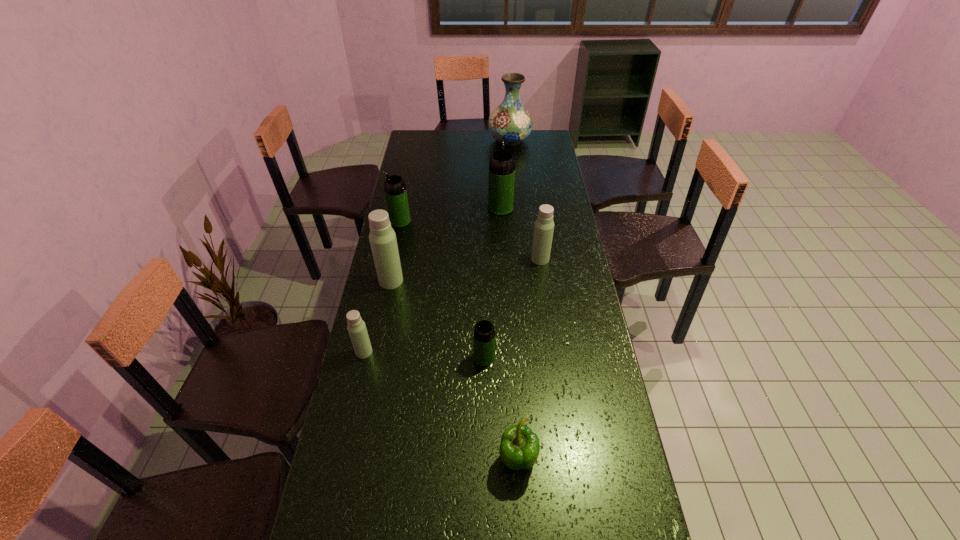
The image size is (960, 540). Find the location of `vacant space situated from the spout of the smallest green thermos bottle`. vacant space situated from the spout of the smallest green thermos bottle is located at coordinates (442, 357).

Where is `vacant space located on the front of the nearest light thermos bottle`? vacant space located on the front of the nearest light thermos bottle is located at coordinates (353, 399).

At what (x,y) coordinates should I click in order to perform the action: click on free location located on the left of the bell pepper. Please return your answer as a coordinate pair (x, y). This screenshot has height=540, width=960. Looking at the image, I should click on (360, 460).

Where is `object at the far edge`? Image resolution: width=960 pixels, height=540 pixels. object at the far edge is located at coordinates (510, 121).

The height and width of the screenshot is (540, 960). What are the coordinates of `vase situated at the right edge` in the screenshot? It's located at (510, 121).

At what (x,y) coordinates should I click in order to perform the action: click on thermos bottle located in the right edge section of the desktop. Please return your answer as a coordinate pair (x, y). Image resolution: width=960 pixels, height=540 pixels. Looking at the image, I should click on (544, 225).

This screenshot has height=540, width=960. In order to click on object positioned at the far right corner in this screenshot , I will do `click(510, 121)`.

The height and width of the screenshot is (540, 960). I want to click on vacant position at the far edge of the desktop, so click(x=458, y=138).

Identify the location of free space at the left edge. The image size is (960, 540). (361, 392).

You are a GUI agent. You are given a task and a screenshot of the screen. Output one action in this format:
    pyautogui.click(x=<x>, y=<y>)
    Task: Click on the vacant region at the right edge of the desktop
    This screenshot has height=540, width=960.
    Given the screenshot: What is the action you would take?
    pyautogui.click(x=580, y=292)